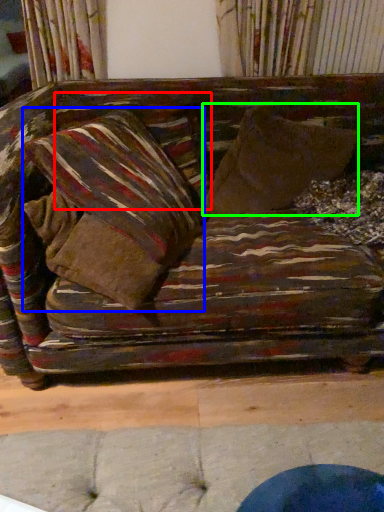
Question: Which is farther away from pillow (highlighted by a red box)? pillow (highlighted by a blue box) or throw pillow (highlighted by a green box)?

Choices:
 (A) pillow
 (B) throw pillow

Answer: (B)